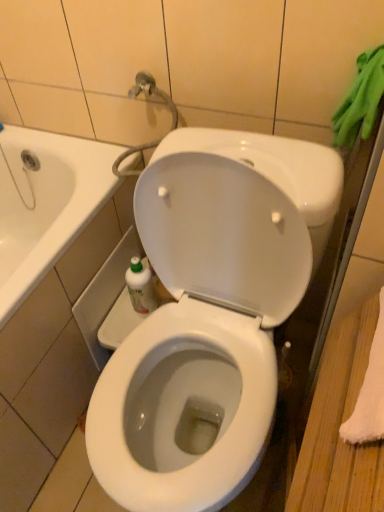
Question: Is translucent plastic bottle at lower left inside or outside of white glossy toilet at center?

Choices:
 (A) outside
 (B) inside

Answer: (A)

Question: Is point (152, 288) positioned closer to the camera than point (253, 275)?

Choices:
 (A) farther
 (B) closer

Answer: (A)

Question: Which object is positioned farthest from the white glossy toilet at center?

Choices:
 (A) green rubber gloves at upper right
 (B) translucent plastic bottle at lower left

Answer: (A)

Question: Based on their relative distances, which object is nearer to the green rubber gloves at upper right?

Choices:
 (A) translucent plastic bottle at lower left
 (B) white glossy toilet at center

Answer: (B)